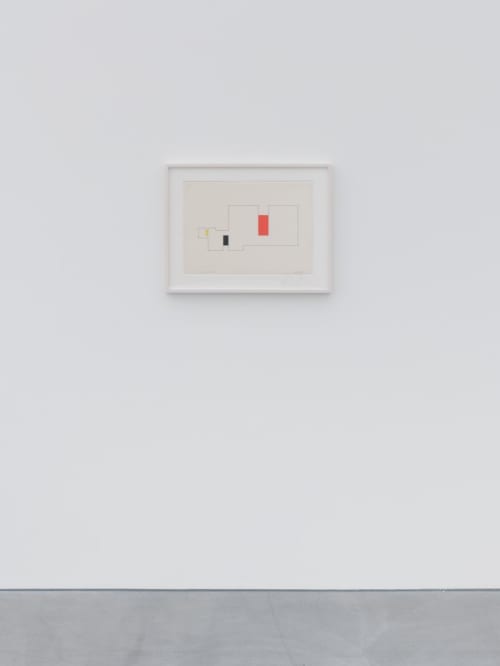
The width and height of the screenshot is (500, 666). I want to click on artwork, so 230,242.